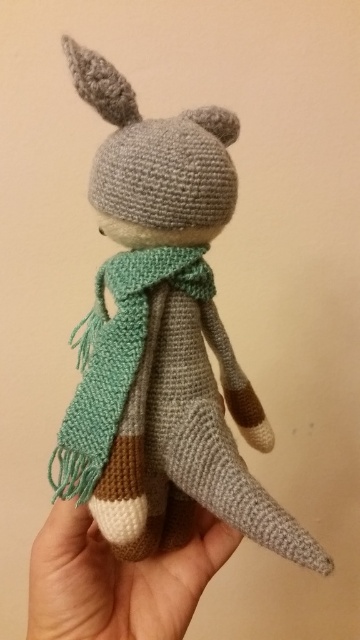
You are a photographer trying to capture the crocheted toy and its accessories in the best possible way. You notice the white soft hand at lower center and the green knitted scarf at center. Which object is shorter in height?

The white soft hand at lower center is shorter in height compared to the green knitted scarf at center.

You are an observer looking at the crocheted toy. You notice a white soft hand at lower center and a green knitted scarf at center. Which object is located to the right of the other?

The white soft hand at lower center is positioned on the right side of green knitted scarf at center.

In the scene shown: You are holding the white soft hand at lower center and want to place it on top of the gray yarn toy at center. Based on their sizes, do you think the hand will fit entirely on the toy?

The gray yarn toy at center is larger in size than the white soft hand at lower center, so the hand should fit entirely on the toy since it is smaller in size.